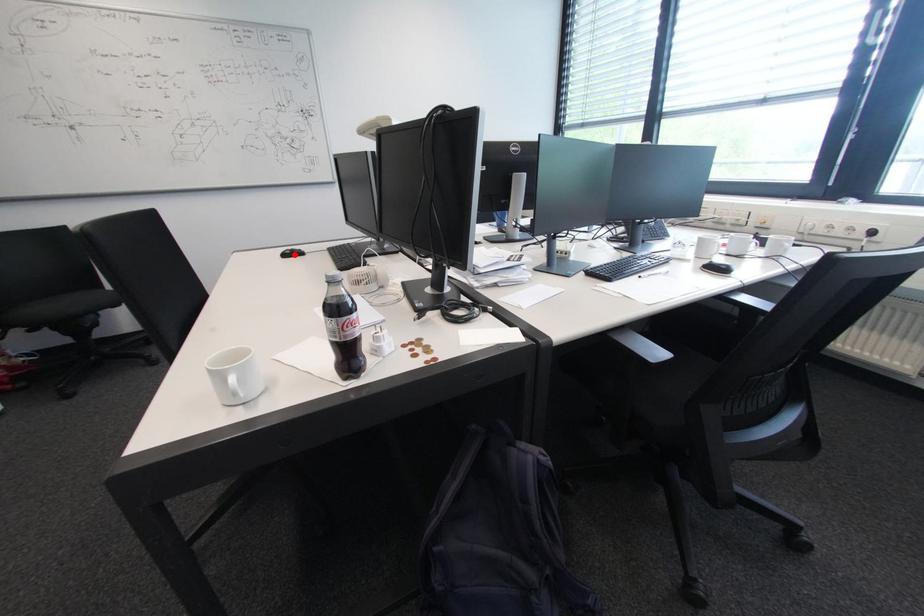
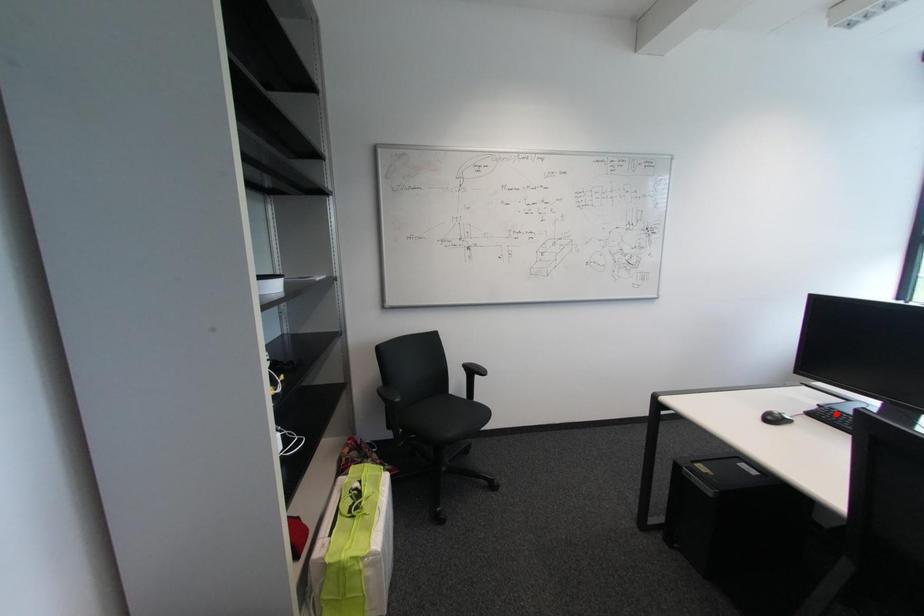
I am providing you with two images of the same scene from different viewpoints. A red point is marked on the first image and another point is marked on the second image. Does the point marked in image1 correspond to the same location as the one in image2?

No